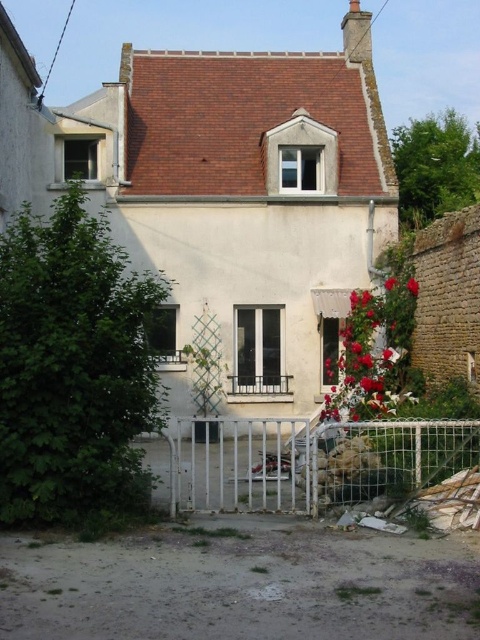
You are a delivery person approaching the house and see the white metal gate at lower center and the vivid red petals at center. Which object is closer to the entrance of the house?

The white metal gate at lower center is closer to the entrance of the house because it is positioned on the left side of the vivid red petals at center, which are further away.